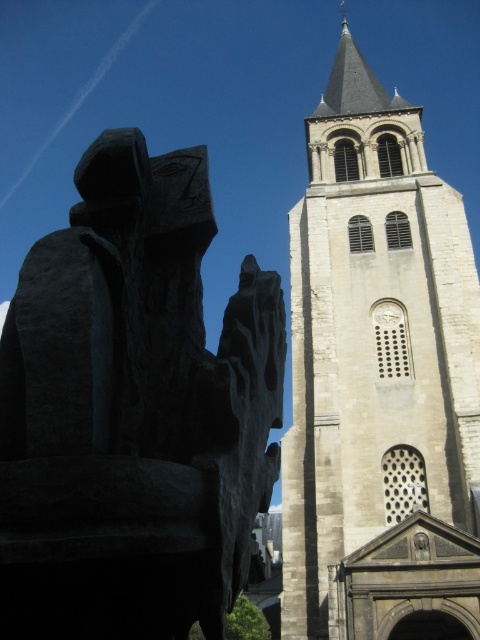
Question: Which point is farther to the camera?

Choices:
 (A) pyautogui.click(x=393, y=352)
 (B) pyautogui.click(x=70, y=396)

Answer: (A)

Question: Does black stone sculpture at left appear over beige stone tower at center?

Choices:
 (A) no
 (B) yes

Answer: (A)

Question: Does black stone sculpture at left appear over beige stone tower at center?

Choices:
 (A) no
 (B) yes

Answer: (A)

Question: Can you confirm if black stone sculpture at left is wider than beige stone tower at center?

Choices:
 (A) no
 (B) yes

Answer: (A)